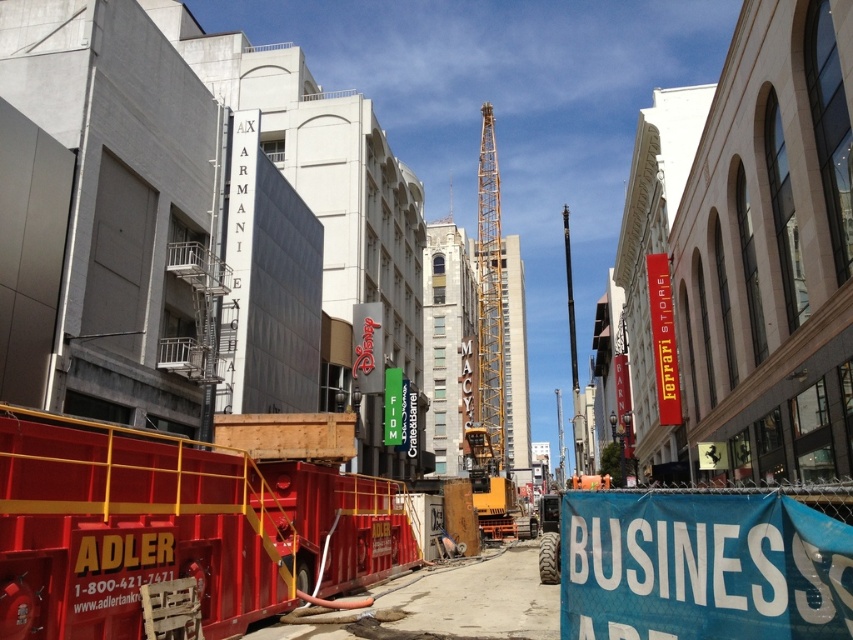
Is blue fabric sign at lower right shorter than yellow metallic crane at center?

Yes, blue fabric sign at lower right is shorter than yellow metallic crane at center.

Which is behind, point (697, 579) or point (477, 221)?

The point (477, 221) is behind.

The height and width of the screenshot is (640, 853). I want to click on blue fabric sign at lower right, so click(701, 566).